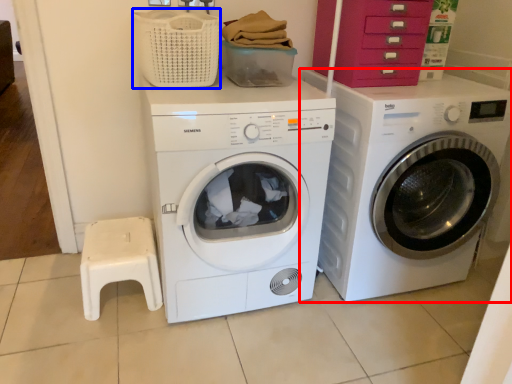
Question: Which point is further to the camera, washing machine (highlighted by a red box) or basket (highlighted by a blue box)?

Choices:
 (A) washing machine
 (B) basket

Answer: (A)